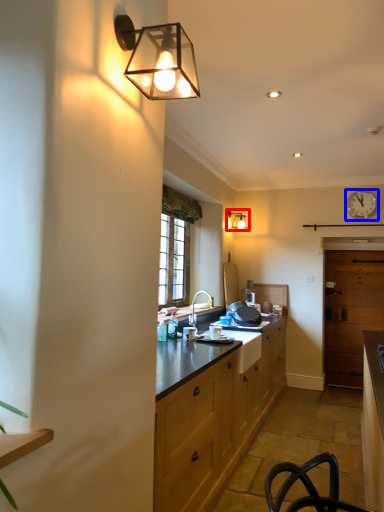
Question: Which point is further to the camera, lamp (highlighted by a red box) or clock (highlighted by a blue box)?

Choices:
 (A) lamp
 (B) clock

Answer: (A)